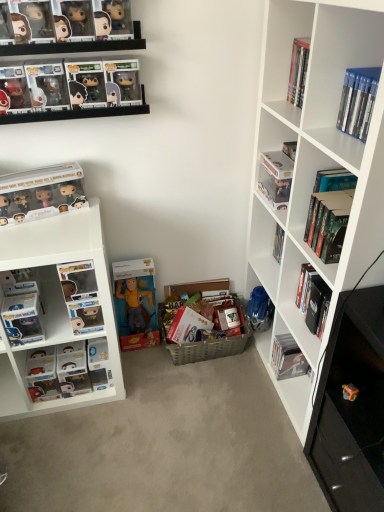
Question: Considering the relative positions of matte black pop vinyl figures at upper left, the eighth book when ordered from right to left, and hardcover book at upper right, acting as the fourth book starting from the left, in the image provided, is matte black pop vinyl figures at upper left, the eighth book when ordered from right to left, to the left of hardcover book at upper right, acting as the fourth book starting from the left, from the viewer's perspective?

Choices:
 (A) no
 (B) yes

Answer: (B)

Question: Is matte black pop vinyl figures at upper left, the eighth book when ordered from right to left, to the right of hardcover book at upper right, which appears as the 5th book when viewed from the right, from the viewer's perspective?

Choices:
 (A) no
 (B) yes

Answer: (A)

Question: Is matte black pop vinyl figures at upper left, the eighth book when ordered from right to left, touching hardcover book at upper right, which appears as the 5th book when viewed from the right?

Choices:
 (A) no
 (B) yes

Answer: (A)

Question: Can you confirm if matte black pop vinyl figures at upper left, which is the first book in left-to-right order, is bigger than hardcover book at upper right, which appears as the 5th book when viewed from the right?

Choices:
 (A) no
 (B) yes

Answer: (B)

Question: Could you tell me if matte black pop vinyl figures at upper left, which is the first book in left-to-right order, is turned towards hardcover book at upper right, which appears as the 5th book when viewed from the right?

Choices:
 (A) yes
 (B) no

Answer: (B)

Question: Would you say matte plastic pop vinyl figure at upper right, which is counted as the sixth book, starting from the right, is inside or outside black matte book at lower right, which appears as the seventh book when viewed from the left?

Choices:
 (A) outside
 (B) inside

Answer: (A)

Question: From the image's perspective, is matte plastic pop vinyl figure at upper right, which is counted as the sixth book, starting from the right, positioned above or below black matte book at lower right, positioned as the 2th book in right-to-left order?

Choices:
 (A) below
 (B) above

Answer: (B)

Question: Is matte plastic pop vinyl figure at upper right, which is counted as the sixth book, starting from the right, taller or shorter than black matte book at lower right, which appears as the seventh book when viewed from the left?

Choices:
 (A) tall
 (B) short

Answer: (B)

Question: In terms of size, does matte plastic pop vinyl figure at upper right, placed as the 3th book when sorted from left to right, appear bigger or smaller than black matte book at lower right, positioned as the 2th book in right-to-left order?

Choices:
 (A) small
 (B) big

Answer: (A)

Question: Is matte plastic pop vinyl figure at lower left, placed as the 7th book when sorted from right to left, bigger or smaller than hardcover book at lower right, the 5th book when ordered from left to right?

Choices:
 (A) small
 (B) big

Answer: (B)

Question: Does point (59, 366) appear closer or farther from the camera than point (288, 358)?

Choices:
 (A) farther
 (B) closer

Answer: (B)

Question: Is matte plastic pop vinyl figure at lower left, placed as the 7th book when sorted from right to left, spatially inside hardcover book at lower right, the 5th book when ordered from left to right, or outside of it?

Choices:
 (A) outside
 (B) inside

Answer: (A)

Question: From their relative heights in the image, would you say matte plastic pop vinyl figure at lower left, placed as the 7th book when sorted from right to left, is taller or shorter than hardcover book at lower right, the 5th book when ordered from left to right?

Choices:
 (A) short
 (B) tall

Answer: (B)

Question: Looking at the image, does white matte bookshelf at right seem bigger or smaller compared to hardcover book at lower right, the fourth book positioned from the right?

Choices:
 (A) big
 (B) small

Answer: (A)

Question: From the image's perspective, is white matte bookshelf at right located above or below hardcover book at lower right, the fourth book positioned from the right?

Choices:
 (A) below
 (B) above

Answer: (B)